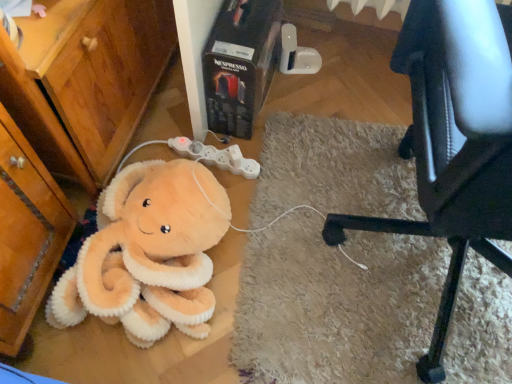
I want to click on free space in front of white plastic game controller at center, so click(x=241, y=215).